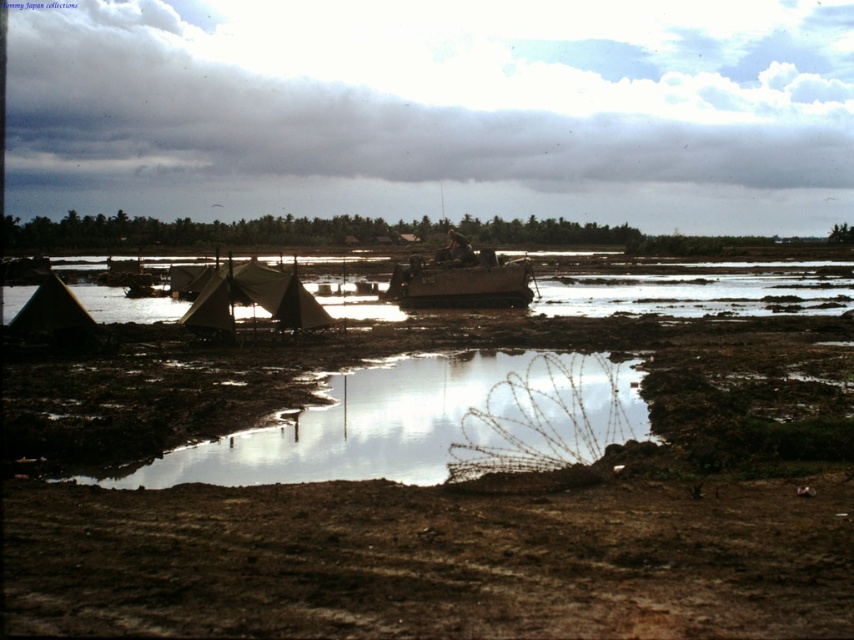
You are a hiker trying to cross the muddy area. You see the reflective mud puddle at center and the matte brown tent at lower left. Which object is shorter?

The reflective mud puddle at center has a lesser height compared to the matte brown tent at lower left, so the reflective mud puddle at center is shorter.